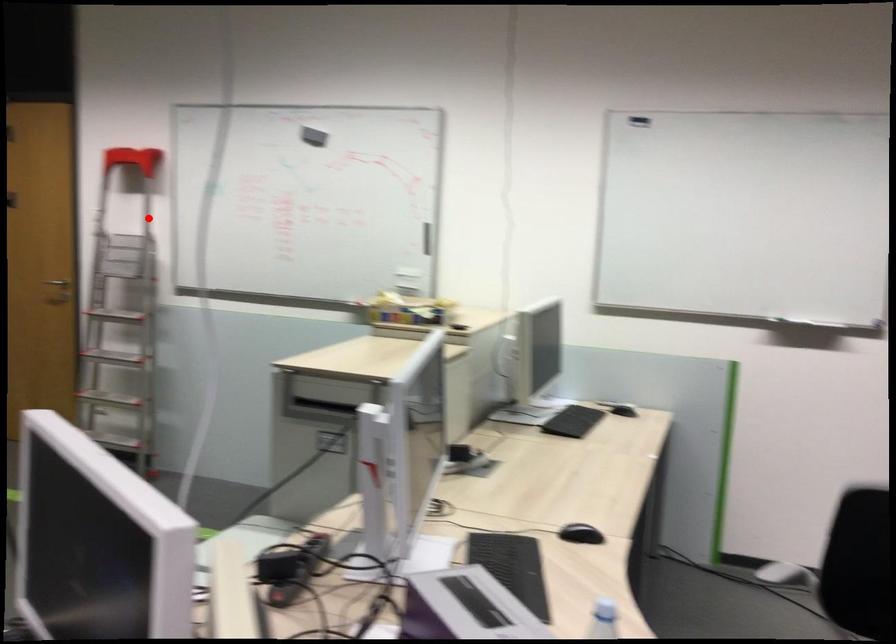
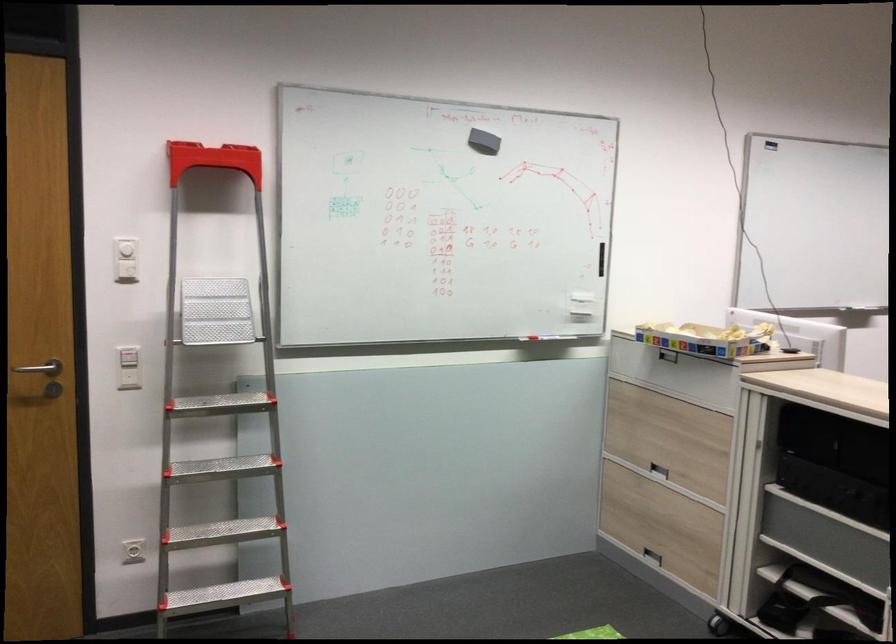
Find the pixel in the second image that matches the highlighted location in the first image.

(125, 269)